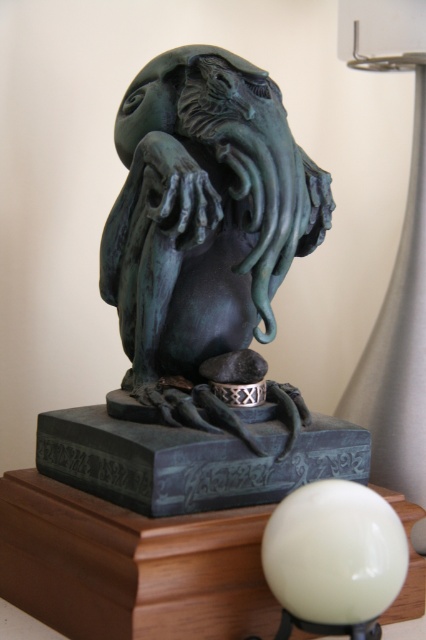
Question: Which of these objects is positioned farthest from the wooden table at lower left?

Choices:
 (A) green patina sculpture at center
 (B) white glossy sphere at lower center

Answer: (A)

Question: Can you confirm if green patina sculpture at center is bigger than white glossy sphere at lower center?

Choices:
 (A) yes
 (B) no

Answer: (A)

Question: Does green patina sculpture at center lie in front of wooden table at lower left?

Choices:
 (A) yes
 (B) no

Answer: (B)

Question: Among these objects, which one is nearest to the camera?

Choices:
 (A) wooden table at lower left
 (B) white glossy sphere at lower center
 (C) green patina sculpture at center

Answer: (B)

Question: Can you confirm if wooden table at lower left is positioned to the right of white glossy sphere at lower center?

Choices:
 (A) no
 (B) yes

Answer: (A)

Question: Which point is farther to the camera?

Choices:
 (A) wooden table at lower left
 (B) white glossy sphere at lower center
 (C) green patina sculpture at center

Answer: (C)